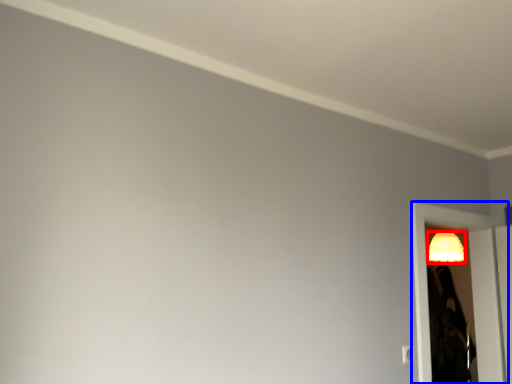
Question: Which object is further to the camera taking this photo, lamp (highlighted by a red box) or screen door (highlighted by a blue box)?

Choices:
 (A) lamp
 (B) screen door

Answer: (A)